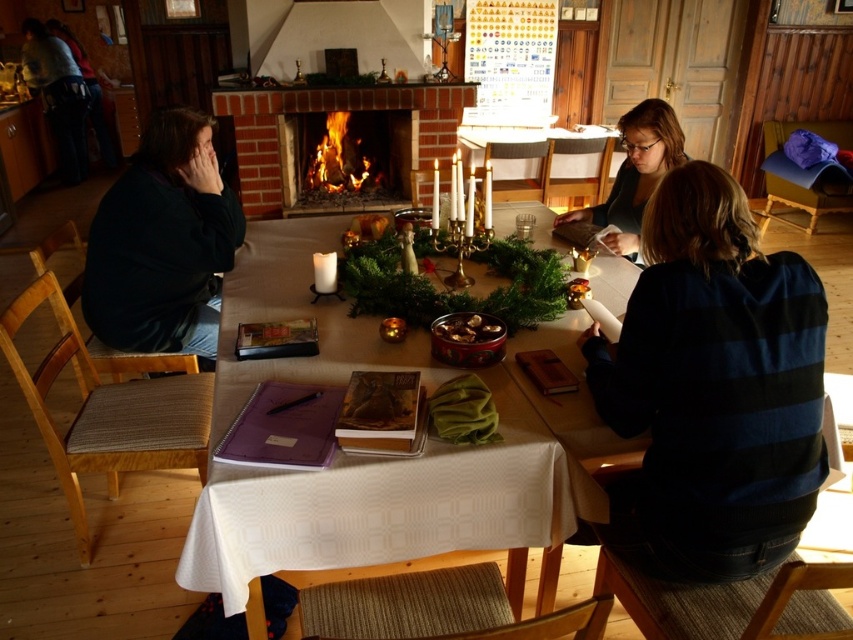
You are organizing a charity event and need to display two items on a shelf. The shelf has limited height space. Given the items are the dark matte jacket at left and the matte black sweater at center, which item might not fit if the shelf can only accommodate items up to the height of the shorter object?

The dark matte jacket at left is taller than the matte black sweater at center, so the dark matte jacket at left might not fit on the shelf if the shelf can only accommodate items up to the height of the shorter object.

You are sitting at the table and want to pick up the dark blue striped sweater at lower right and the dark matte jacket at left. Which one can you reach without moving your chair?

The dark blue striped sweater at lower right is closer to the viewer, so you can reach it without moving your chair, but the dark matte jacket at left is further away and may require moving your chair.

You are organizing a winter clothing drive and need to stack the dark matte jacket at left and the matte black sweater at center. Based on their positions in the image, which item should you place on top to ensure stability?

The dark matte jacket at left should be placed on top of the matte black sweater at center because it is located below the sweater in the image, indicating it is lower and thus more stable when stacked.